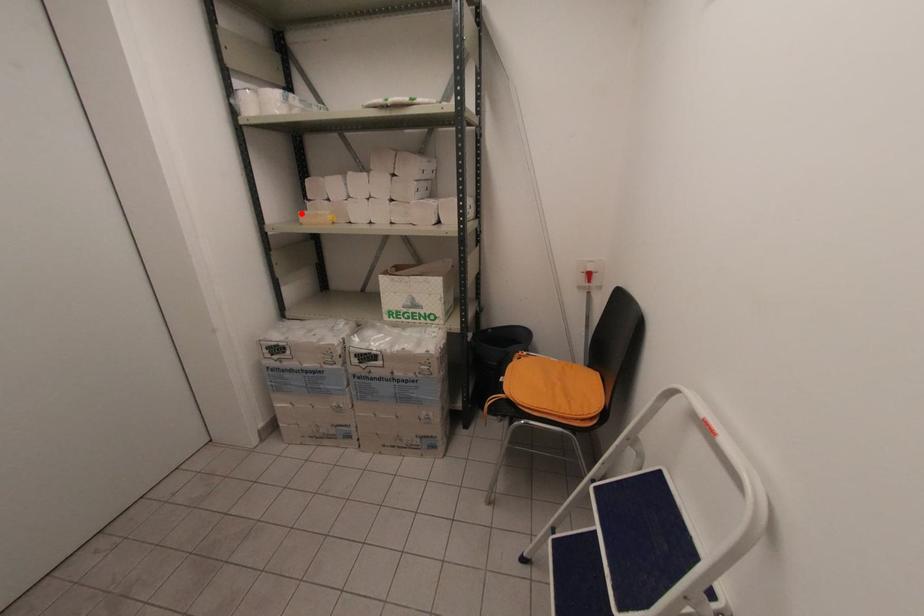
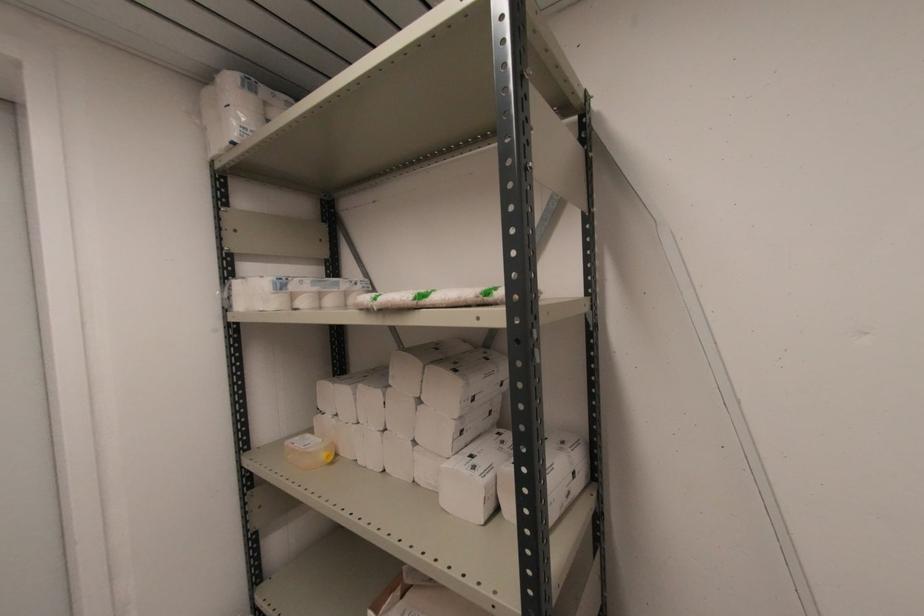
Locate, in the second image, the point that corresponds to the highlighted location in the first image.

(289, 442)